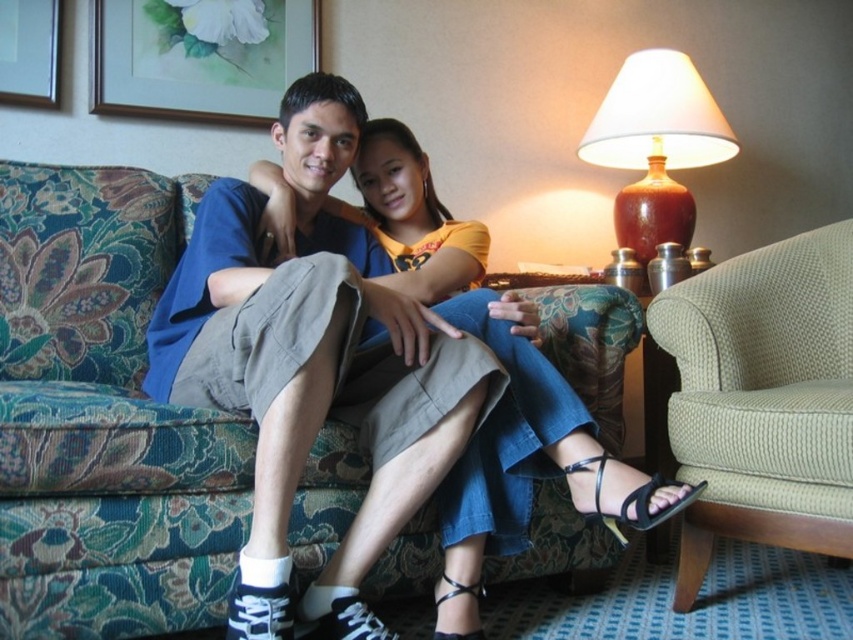
Question: Which object is the closest to the floral fabric couch at center?

Choices:
 (A) brown ceramic lamp at upper right
 (B) matte floral painting at upper left
 (C) green fabric armchair at right

Answer: (C)

Question: Which of the following is the closest to the observer?

Choices:
 (A) (706, 484)
 (B) (283, 72)
 (C) (25, 189)
 (D) (363, 156)

Answer: (A)

Question: Can you confirm if green fabric armchair at right is smaller than brown ceramic lamp at upper right?

Choices:
 (A) no
 (B) yes

Answer: (A)

Question: Is floral fabric couch at center behind jeans at center?

Choices:
 (A) yes
 (B) no

Answer: (B)

Question: Estimate the real-world distances between objects in this image. Which object is farther from the green fabric armchair at right?

Choices:
 (A) matte floral painting at upper left
 (B) floral fabric couch at center

Answer: (A)

Question: Considering the relative positions of floral fabric couch at center and jeans at center in the image provided, where is floral fabric couch at center located with respect to jeans at center?

Choices:
 (A) left
 (B) right

Answer: (A)